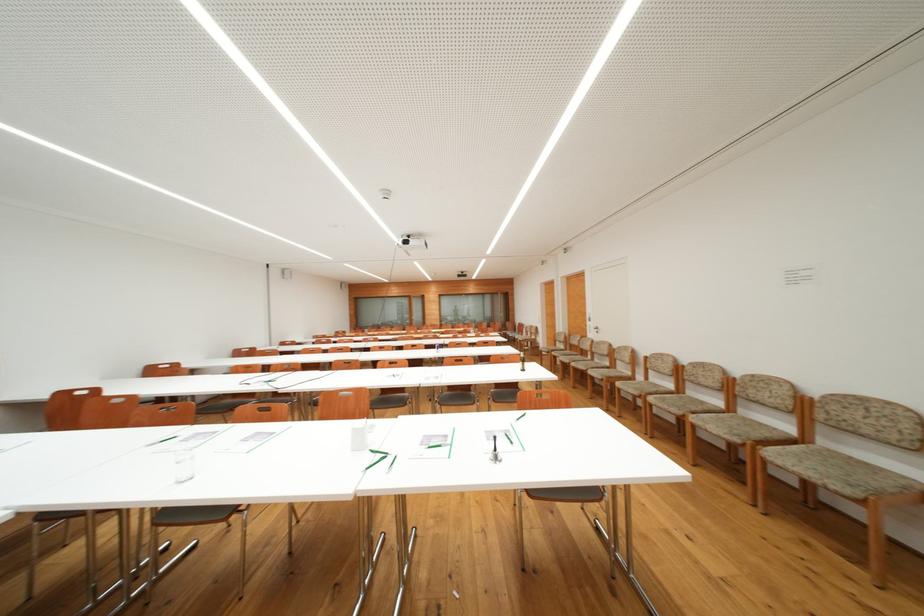
What do you see at coordinates (184, 464) in the screenshot? I see `the clear drinking glass` at bounding box center [184, 464].